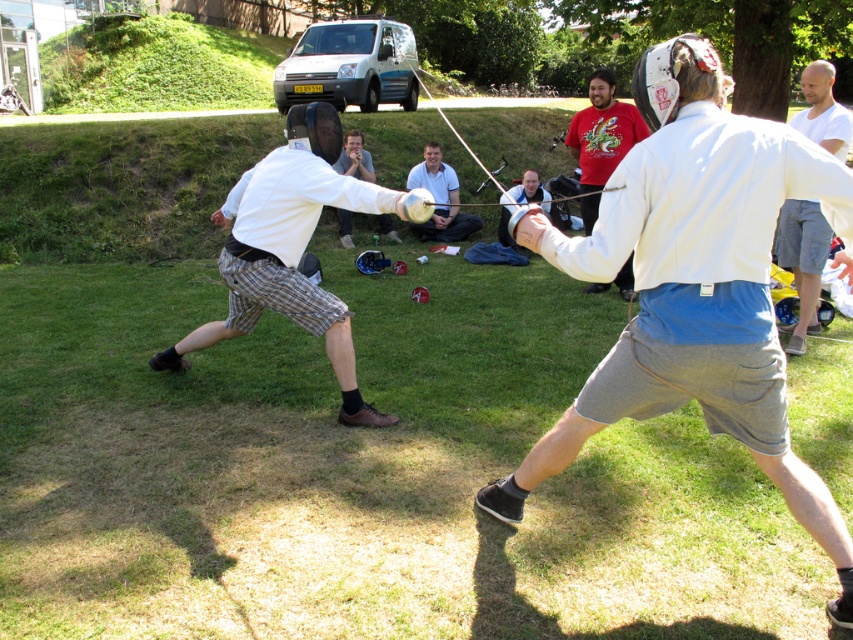
You are a coach analyzing the fencers during a match. You notice two points marked on the field at coordinates point (695,93) and point (817,289). Which point is closer to the fencer on the left?

Point (695,93) is in front of point (817,289), so it is closer to the fencer on the left.

You are a photographer at the fencing match. You want to capture a photo where the matte silver helmet at center and the matte white helmet at center are both visible. Based on their positions, which helmet should you focus on first to ensure both are in frame?

The matte silver helmet at center is located above the matte white helmet at center, so you should focus on the matte silver helmet at center first to ensure both are in frame.

You are a photographer at the fencing match and want to capture a clear shot of both the matte silver helmet at center and the matte white helmet at center. Since you need to focus on the taller helmet first, which one should you adjust your camera to focus on?

The matte silver helmet at center is taller than the matte white helmet at center, so you should focus on the matte silver helmet at center first.